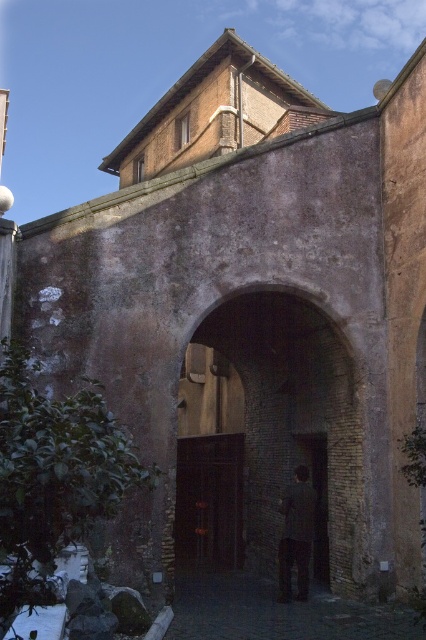
Does dark brick archway at center appear over dark stone alley at center?

Correct, dark brick archway at center is located above dark stone alley at center.

Is point (259, 298) less distant than point (356, 611)?

No, it is behind (356, 611).

Locate an element on the screen. Image resolution: width=426 pixels, height=640 pixels. dark brick archway at center is located at coordinates (267, 438).

Who is positioned more to the left, dark stone alley at center or dark gray suit at center?

dark stone alley at center is more to the left.

Can you confirm if dark stone alley at center is thinner than dark gray suit at center?

In fact, dark stone alley at center might be wider than dark gray suit at center.

Find the location of a particular element. dark stone alley at center is located at coordinates (279, 612).

Is point (242, 531) less distant than point (281, 541)?

No, it is not.

This screenshot has height=640, width=426. What do you see at coordinates (267, 438) in the screenshot? I see `dark brick archway at center` at bounding box center [267, 438].

The height and width of the screenshot is (640, 426). I want to click on dark brick archway at center, so click(267, 438).